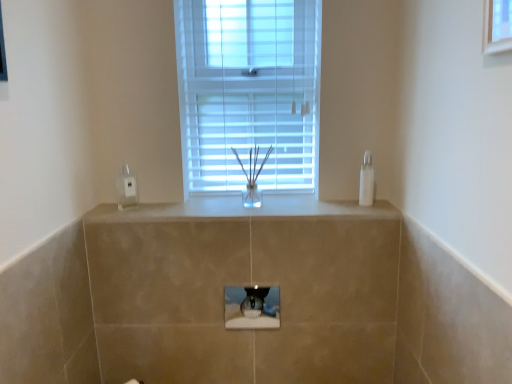
Question: Does clear plastic electric outlet at left have a smaller size compared to transparent glass hole at center?

Choices:
 (A) no
 (B) yes

Answer: (B)

Question: Considering the relative sizes of clear plastic electric outlet at left and transparent glass hole at center in the image provided, is clear plastic electric outlet at left taller than transparent glass hole at center?

Choices:
 (A) no
 (B) yes

Answer: (B)

Question: From a real-world perspective, is clear plastic electric outlet at left physically below transparent glass hole at center?

Choices:
 (A) no
 (B) yes

Answer: (A)

Question: Is clear plastic electric outlet at left far away from transparent glass hole at center?

Choices:
 (A) no
 (B) yes

Answer: (A)

Question: Is clear plastic electric outlet at left at the left side of transparent glass hole at center?

Choices:
 (A) yes
 (B) no

Answer: (A)

Question: Is clear plastic electric outlet at left directly adjacent to transparent glass hole at center?

Choices:
 (A) no
 (B) yes

Answer: (A)

Question: Considering the relative positions of white plastic window at center and transparent glass hole at center in the image provided, is white plastic window at center to the right of transparent glass hole at center from the viewer's perspective?

Choices:
 (A) yes
 (B) no

Answer: (B)

Question: Are white plastic window at center and transparent glass hole at center beside each other?

Choices:
 (A) yes
 (B) no

Answer: (B)

Question: Is white plastic window at center positioned before transparent glass hole at center?

Choices:
 (A) no
 (B) yes

Answer: (A)

Question: Is white plastic window at center bigger than transparent glass hole at center?

Choices:
 (A) no
 (B) yes

Answer: (B)

Question: From the image's perspective, is white plastic window at center below transparent glass hole at center?

Choices:
 (A) no
 (B) yes

Answer: (A)

Question: Is white plastic window at center far from transparent glass hole at center?

Choices:
 (A) no
 (B) yes

Answer: (A)

Question: Is white glossy counter top at center at the right side of transparent plastic soap dispenser at right?

Choices:
 (A) no
 (B) yes

Answer: (A)